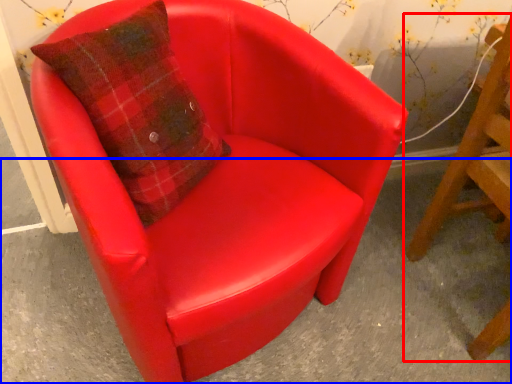
Question: Which point is closer to the camera, chair (highlighted by a red box) or concrete (highlighted by a blue box)?

Choices:
 (A) chair
 (B) concrete

Answer: (A)